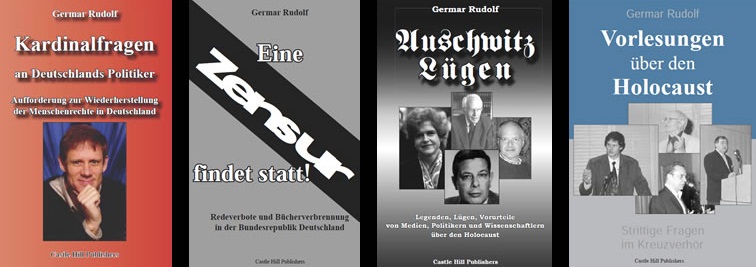
Where is `the third book from left`? the third book from left is located at coordinates (440, 141).